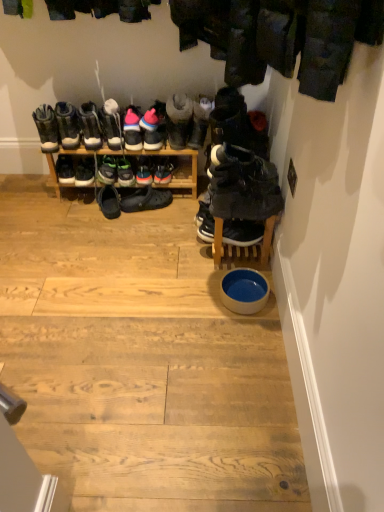
You are a GUI agent. You are given a task and a screenshot of the screen. Output one action in this format:
    pyautogui.click(x=<x>, y=<y>)
    Task: Click on the free space in front of blue ceramic bowl at center
    The width and height of the screenshot is (384, 512).
    Given the screenshot: What is the action you would take?
    pyautogui.click(x=243, y=337)